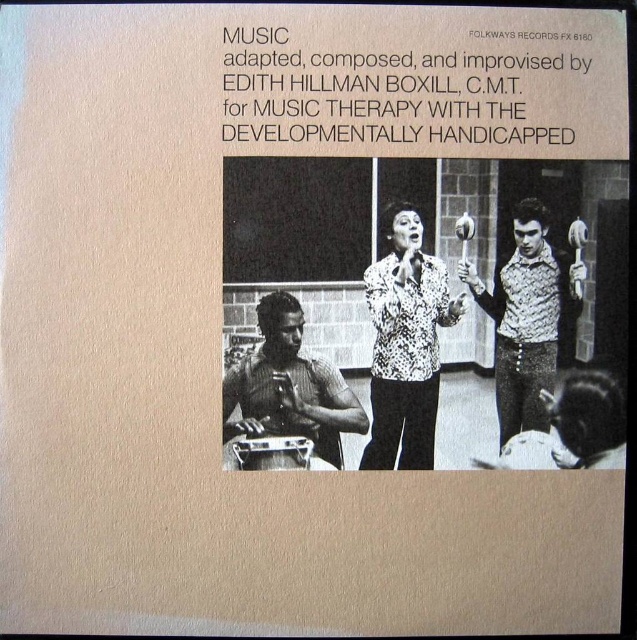
You are an observer looking at the album cover. The patterned fabric vest at right and the metallic drum at lower left are both in the photo. Which object is nearer to you?

The patterned fabric vest at right is closer to the viewer than the metallic drum at lower left.

You are a photographer taking a picture of the spotted patterned shirt at center. If your camera can only focus on objects within 30 inches, will the shirt be in focus?

The spotted patterned shirt at center is 30.75 inches from the camera, which is beyond the 30 inches focus range. Therefore, the shirt will not be in focus.

You are standing in front of the record album cover FX 6180. You notice a specific point marked at coordinates point [419,364]. If you want to place a small sticker exactly 20 inches away from this point towards the viewer, where would you place it?

The point [419,364] is 31.07 inches away from the viewer. To place a sticker 20 inches away from this point towards the viewer, subtract 20 inches from the current distance, resulting in a placement at 11.07 inches from the viewer. However, since the sticker must be placed on the album cover itself, this distance measurement might not translate directly to physical placement on the 2D surface.